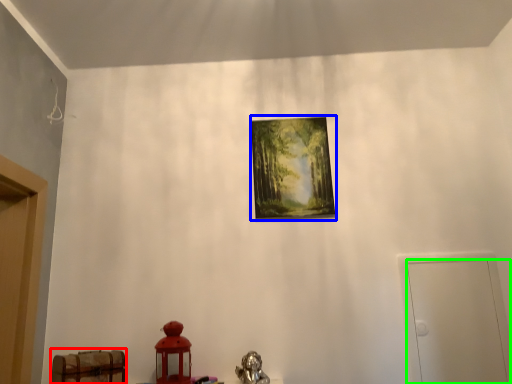
Question: Based on their relative distances, which object is farther from furniture (highlighted by a red box)? Choose from picture frame (highlighted by a blue box) and door (highlighted by a green box).

Choices:
 (A) picture frame
 (B) door

Answer: (B)